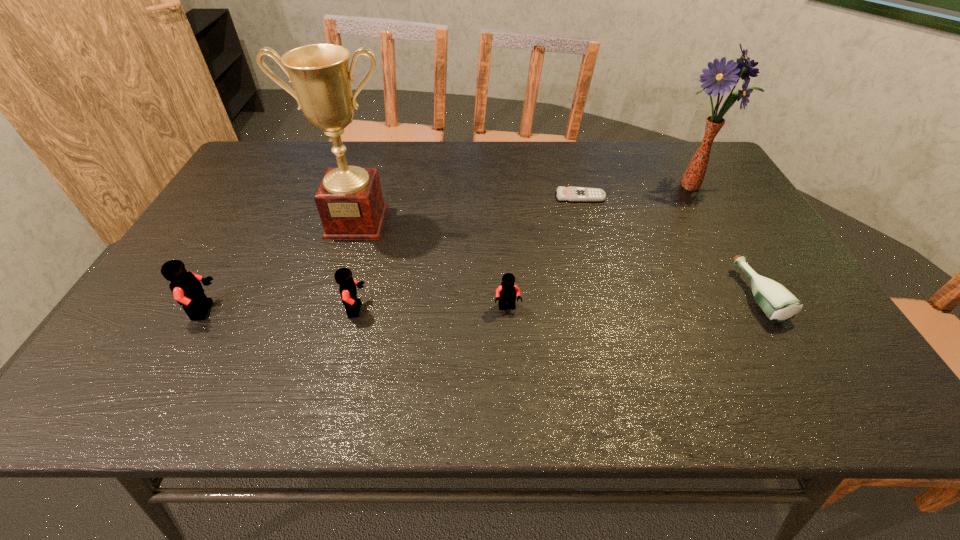
You are a GUI agent. You are given a task and a screenshot of the screen. Output one action in this format:
    pyautogui.click(x=<x>, y=<y>)
    Task: Click on the object that is at the left edge
    
    Given the screenshot: What is the action you would take?
    pyautogui.click(x=186, y=287)

Locate an element on the screen. flower arrangement that is at the right edge is located at coordinates (717, 79).

This screenshot has height=540, width=960. Find the location of `bottle present at the right edge`. bottle present at the right edge is located at coordinates (779, 304).

Where is `object at the near left corner`? This screenshot has height=540, width=960. object at the near left corner is located at coordinates (186, 287).

Locate an element on the screen. The width and height of the screenshot is (960, 540). object positioned at the far right corner is located at coordinates (717, 79).

You are a GUI agent. You are given a task and a screenshot of the screen. Output one action in this format:
    pyautogui.click(x=<x>, y=<y>)
    Task: Click on the object present at the near right corner
    Image resolution: width=960 pixels, height=540 pixels.
    Given the screenshot: What is the action you would take?
    pyautogui.click(x=779, y=304)

Identify the location of free space at the far edge of the desktop. The height and width of the screenshot is (540, 960). (614, 150).

The width and height of the screenshot is (960, 540). In the image, there is a desktop. Find the location of `free space at the near edge`. free space at the near edge is located at coordinates (715, 358).

Image resolution: width=960 pixels, height=540 pixels. In the image, there is a desktop. Find the location of `vacant space at the right edge`. vacant space at the right edge is located at coordinates (718, 220).

This screenshot has height=540, width=960. In order to click on vacant space at the far left corner of the desktop in this screenshot , I will do `click(291, 151)`.